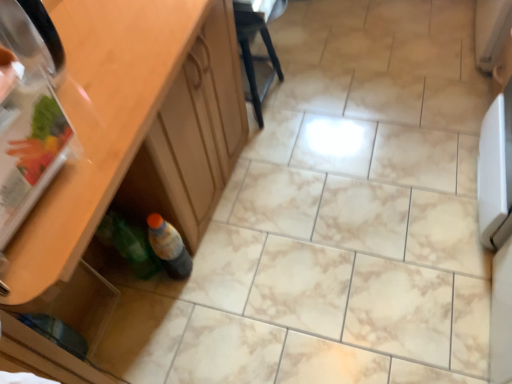
You are a GUI agent. You are given a task and a screenshot of the screen. Output one action in this format:
    pyautogui.click(x=<x>, y=<y>)
    Task: Click on the wooden cabinet at lower left
    This screenshot has width=512, height=384.
    Given the screenshot: What is the action you would take?
    [130, 143]

How much space does green plastic bottle at lower left, acting as the 2th bottle starting from the right, occupy vertically?

It is 13.45 inches.

Describe the element at coordinates (168, 247) in the screenshot. I see `translucent plastic bottle at lower left, arranged as the first bottle when viewed from the right` at that location.

Locate an element on the screen. The height and width of the screenshot is (384, 512). black plastic chair at center is located at coordinates (264, 43).

Does green plastic bottle at lower left, which ranks as the first bottle in left-to-right order, appear on the left side of translucent plastic bottle at lower left, arranged as the first bottle when viewed from the right?

Yes.

Is green plastic bottle at lower left, which ranks as the first bottle in left-to-right order, positioned with its back to translucent plastic bottle at lower left, arranged as the first bottle when viewed from the right?

No, green plastic bottle at lower left, which ranks as the first bottle in left-to-right order, is not facing away from translucent plastic bottle at lower left, arranged as the first bottle when viewed from the right.

From a real-world perspective, is green plastic bottle at lower left, which ranks as the first bottle in left-to-right order, physically below translucent plastic bottle at lower left, arranged as the first bottle when viewed from the right?

No.

From the image's perspective, between black plastic chair at center and transparent plastic drawer at lower left, who is located below?

transparent plastic drawer at lower left.

Is black plastic chair at center to the right of transparent plastic drawer at lower left from the viewer's perspective?

Correct, you'll find black plastic chair at center to the right of transparent plastic drawer at lower left.

Does green plastic bottle at lower left, which ranks as the first bottle in left-to-right order, have a smaller size compared to wooden cabinet at lower left?

Correct, green plastic bottle at lower left, which ranks as the first bottle in left-to-right order, occupies less space than wooden cabinet at lower left.

Is green plastic bottle at lower left, acting as the 2th bottle starting from the right, in front of or behind wooden cabinet at lower left in the image?

→ Clearly, green plastic bottle at lower left, acting as the 2th bottle starting from the right, is behind wooden cabinet at lower left.

Is wooden cabinet at lower left not near green plastic bottle at lower left, acting as the 2th bottle starting from the right?

No, wooden cabinet at lower left is not far away from green plastic bottle at lower left, acting as the 2th bottle starting from the right.

Which bottle is the 2nd one when counting from the left side of the wooden cabinet at lower left? Please provide its 2D coordinates.

[(129, 244)]

Can you confirm if wooden cabinet at lower left is shorter than green plastic bottle at lower left, which ranks as the first bottle in left-to-right order?

No.

Is wooden cabinet at lower left wider or thinner than green plastic bottle at lower left, acting as the 2th bottle starting from the right?

wooden cabinet at lower left is wider than green plastic bottle at lower left, acting as the 2th bottle starting from the right.

From a real-world perspective, is black plastic chair at center physically located above or below green plastic bottle at lower left, acting as the 2th bottle starting from the right?

From a real-world perspective, black plastic chair at center is physically above green plastic bottle at lower left, acting as the 2th bottle starting from the right.

Does black plastic chair at center contain green plastic bottle at lower left, acting as the 2th bottle starting from the right?

That's incorrect, green plastic bottle at lower left, acting as the 2th bottle starting from the right, is not inside black plastic chair at center.

Does black plastic chair at center touch green plastic bottle at lower left, acting as the 2th bottle starting from the right?

black plastic chair at center and green plastic bottle at lower left, acting as the 2th bottle starting from the right, are not in contact.

The width and height of the screenshot is (512, 384). In the image, there is a green plastic bottle at lower left, which ranks as the first bottle in left-to-right order. What are the coordinates of `chair above it (from the image's perspective)` in the screenshot? It's located at click(x=264, y=43).

Considering the sizes of objects wooden cabinet at lower left and black plastic chair at center in the image provided, who is thinner, wooden cabinet at lower left or black plastic chair at center?

With smaller width is black plastic chair at center.

From the image's perspective, who appears lower, wooden cabinet at lower left or black plastic chair at center?

wooden cabinet at lower left.

Is wooden cabinet at lower left far away from black plastic chair at center?

No, there isn't a large distance between wooden cabinet at lower left and black plastic chair at center.

Consider the image. From a real-world perspective, is wooden cabinet at lower left positioned under black plastic chair at center based on gravity?

No, from a real-world perspective, wooden cabinet at lower left is not beneath black plastic chair at center.

Could you tell me if wooden cabinet at lower left is turned towards transparent plastic drawer at lower left?

No.

At what (x,y) coordinates should I click in order to perform the action: click on cabinetry that appears on the right of transparent plastic drawer at lower left. Please return your answer as a coordinate pair (x, y). Looking at the image, I should click on (130, 143).

Does wooden cabinet at lower left appear on the left side of transparent plastic drawer at lower left?

Incorrect, wooden cabinet at lower left is not on the left side of transparent plastic drawer at lower left.

You are a GUI agent. You are given a task and a screenshot of the screen. Output one action in this format:
    pyautogui.click(x=<x>, y=<y>)
    Task: Click on the bottle above the green plastic bottle at lower left, acting as the 2th bottle starting from the right (from the image's perspective)
    
    Given the screenshot: What is the action you would take?
    pyautogui.click(x=168, y=247)

You are a GUI agent. You are given a task and a screenshot of the screen. Output one action in this format:
    pyautogui.click(x=<x>, y=<y>)
    Task: Click on the chair behind the transparent plastic drawer at lower left
    
    Given the screenshot: What is the action you would take?
    tap(264, 43)

Considering their positions, is green plastic bottle at lower left, which ranks as the first bottle in left-to-right order, positioned closer to black plastic chair at center than wooden cabinet at lower left?

The object closer to black plastic chair at center is wooden cabinet at lower left.

Considering their positions, is green plastic bottle at lower left, which ranks as the first bottle in left-to-right order, positioned closer to translucent plastic bottle at lower left, arranged as the first bottle when viewed from the right, than wooden cabinet at lower left?

green plastic bottle at lower left, which ranks as the first bottle in left-to-right order.

When comparing their distances from green plastic bottle at lower left, acting as the 2th bottle starting from the right, does wooden cabinet at lower left or transparent plastic drawer at lower left seem further?

Among the two, wooden cabinet at lower left is located further to green plastic bottle at lower left, acting as the 2th bottle starting from the right.

Based on the photo, when comparing their distances from wooden cabinet at lower left, does translucent plastic bottle at lower left, the second bottle viewed from the left, or black plastic chair at center seem further?

black plastic chair at center lies further to wooden cabinet at lower left than the other object.

Considering their positions, is wooden cabinet at lower left positioned closer to transparent plastic drawer at lower left than green plastic bottle at lower left, which ranks as the first bottle in left-to-right order?

green plastic bottle at lower left, which ranks as the first bottle in left-to-right order.

Consider the image. Estimate the real-world distances between objects in this image. Which object is further from translucent plastic bottle at lower left, arranged as the first bottle when viewed from the right, black plastic chair at center or transparent plastic drawer at lower left?

black plastic chair at center is positioned further to the anchor translucent plastic bottle at lower left, arranged as the first bottle when viewed from the right.

Estimate the real-world distances between objects in this image. Which object is further from wooden cabinet at lower left, black plastic chair at center or green plastic bottle at lower left, acting as the 2th bottle starting from the right?

black plastic chair at center.

Based on their spatial positions, is green plastic bottle at lower left, acting as the 2th bottle starting from the right, or translucent plastic bottle at lower left, arranged as the first bottle when viewed from the right, further from transparent plastic drawer at lower left?

translucent plastic bottle at lower left, arranged as the first bottle when viewed from the right, lies further to transparent plastic drawer at lower left than the other object.

Where is `bottle between black plastic chair at center and green plastic bottle at lower left, which ranks as the first bottle in left-to-right order, from top to bottom`? bottle between black plastic chair at center and green plastic bottle at lower left, which ranks as the first bottle in left-to-right order, from top to bottom is located at coordinates (168, 247).

Locate an element on the screen. This screenshot has width=512, height=384. bottle between transparent plastic drawer at lower left and translucent plastic bottle at lower left, the second bottle viewed from the left, in the horizontal direction is located at coordinates (129, 244).

Find the location of a particular element. cabinetry that lies between black plastic chair at center and transparent plastic drawer at lower left from top to bottom is located at coordinates (130, 143).

The image size is (512, 384). Identify the location of bottle between wooden cabinet at lower left and translucent plastic bottle at lower left, the second bottle viewed from the left, from front to back. (129, 244).